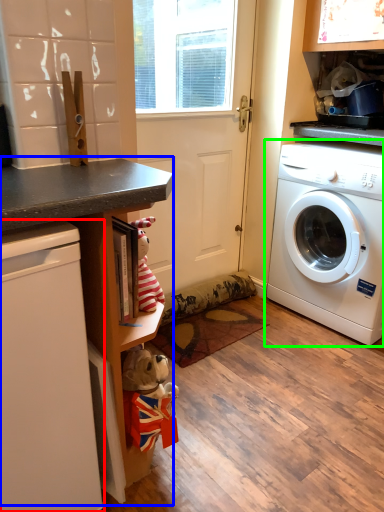
Question: Considering the real-world distances, which object is closest to dish washer (highlighted by a red box)? counter (highlighted by a blue box) or washing machine (highlighted by a green box).

Choices:
 (A) counter
 (B) washing machine

Answer: (A)